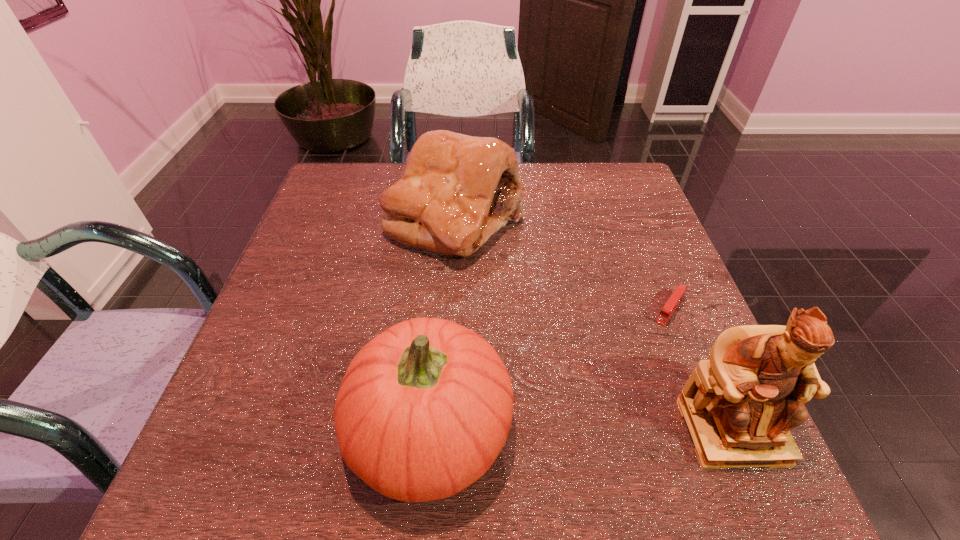
What are the coordinates of `pumpkin` in the screenshot? It's located at (424, 409).

Locate an element on the screen. The height and width of the screenshot is (540, 960). the tallest object is located at coordinates [x=739, y=406].

Identify the location of the third tallest object. (457, 190).

Where is `bread`? bread is located at coordinates (457, 190).

Locate an element on the screen. the second farthest object is located at coordinates (678, 294).

The height and width of the screenshot is (540, 960). What are the coordinates of `the shortest object` in the screenshot? It's located at (678, 294).

Where is `free space located on the right of the pumpkin`? This screenshot has width=960, height=540. free space located on the right of the pumpkin is located at coordinates (708, 429).

Identify the location of free space located 0.350m on the filling side of the second shortest object. The image size is (960, 540). (562, 393).

Image resolution: width=960 pixels, height=540 pixels. Identify the location of vacant position located 0.170m on the filling side of the second shortest object. (516, 321).

Find the location of a particular element. vacant region located on the filling side of the second shortest object is located at coordinates (528, 339).